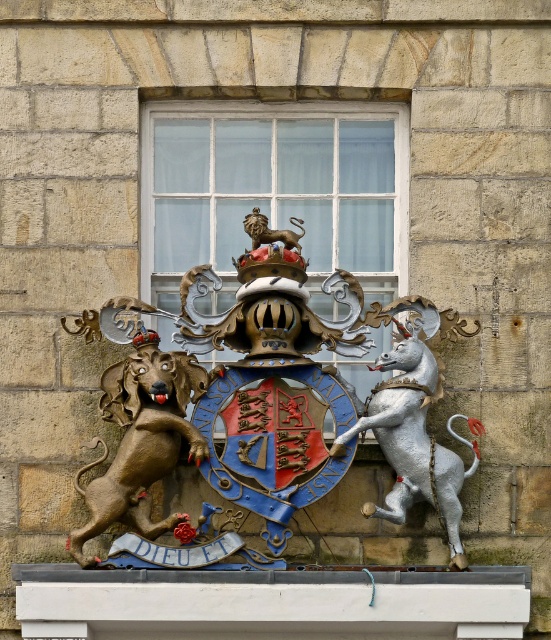
Question: Which of these objects is positioned farthest from the polished bronze lion at center?

Choices:
 (A) white glass window at center
 (B) bronze/statue dog at left

Answer: (A)

Question: Can you confirm if polished bronze lion at center is wider than silver metallic unicorn at right?

Choices:
 (A) yes
 (B) no

Answer: (A)

Question: Is white glass window at center to the left of white marble ledge at center from the viewer's perspective?

Choices:
 (A) no
 (B) yes

Answer: (A)

Question: Which point appears farthest from the camera in this image?

Choices:
 (A) (195, 180)
 (B) (456, 550)
 (C) (186, 636)

Answer: (A)

Question: From the image, what is the correct spatial relationship of white glass window at center in relation to silver metallic unicorn at right?

Choices:
 (A) right
 (B) left

Answer: (B)

Question: Which of these objects is positioned closest to the silver metallic unicorn at right?

Choices:
 (A) bronze/statue dog at left
 (B) white marble ledge at center

Answer: (A)